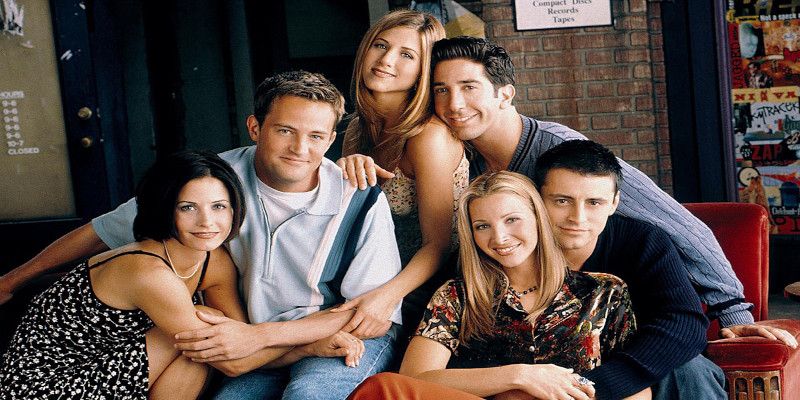
The image size is (800, 400). Find the location of `door lock`. door lock is located at coordinates (86, 111).